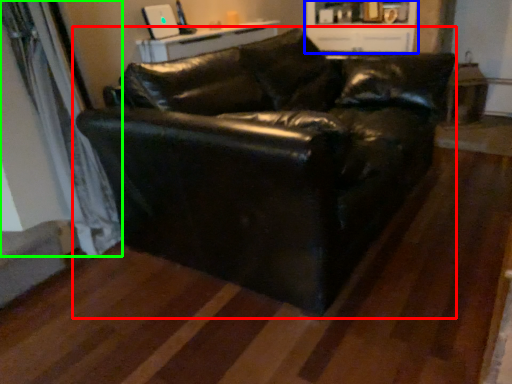
Question: Considering the real-world distances, which object is farthest from studio couch (highlighted by a red box)? entertainment center (highlighted by a blue box) or curtain (highlighted by a green box)?

Choices:
 (A) entertainment center
 (B) curtain

Answer: (A)